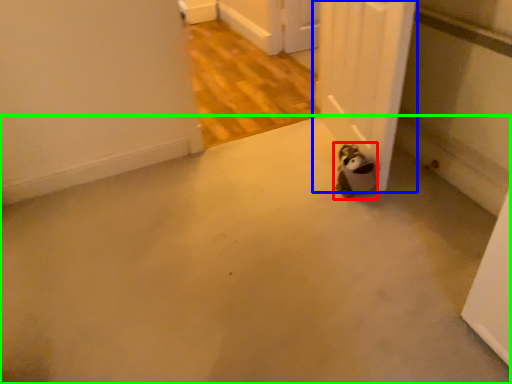
Question: Which is farther away from animal (highlighted by a red box)? door (highlighted by a blue box) or concrete (highlighted by a green box)?

Choices:
 (A) door
 (B) concrete

Answer: (B)